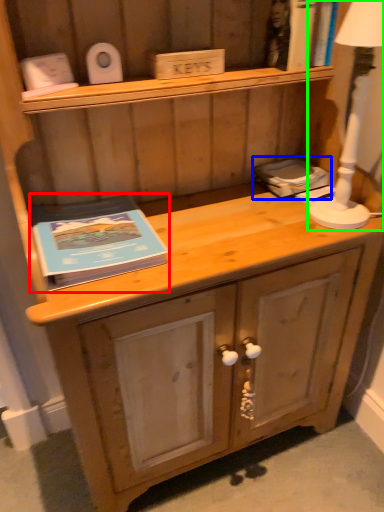
Question: Considering the real-world distances, which object is farthest from paperback book (highlighted by a red box)? book (highlighted by a blue box) or bedside lamp (highlighted by a green box)?

Choices:
 (A) book
 (B) bedside lamp

Answer: (B)